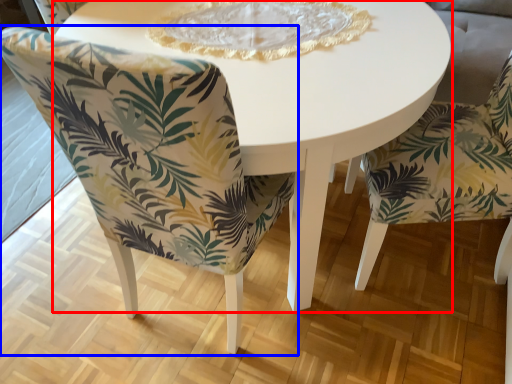
Question: Which object is closer to the camera taking this photo, coffee table (highlighted by a red box) or chair (highlighted by a blue box)?

Choices:
 (A) coffee table
 (B) chair

Answer: (B)